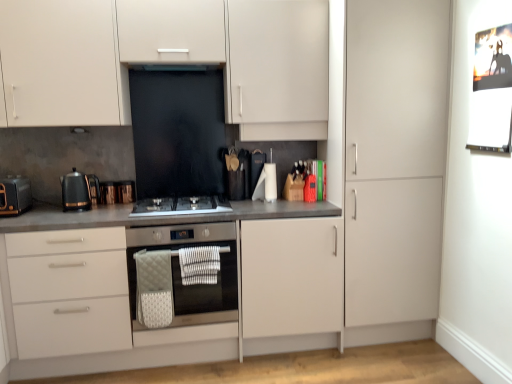
Question: Is copper metallic toaster at left, the 1th appliance viewed from the left, positioned with its back to matte gray countertop at center?

Choices:
 (A) yes
 (B) no

Answer: (B)

Question: Is copper metallic toaster at left, the 2th appliance viewed from the right, closer to the viewer compared to matte gray countertop at center?

Choices:
 (A) yes
 (B) no

Answer: (B)

Question: Is copper metallic toaster at left, the 1th appliance viewed from the left, smaller than matte gray countertop at center?

Choices:
 (A) yes
 (B) no

Answer: (A)

Question: From a real-world perspective, is copper metallic toaster at left, the 1th appliance viewed from the left, on top of matte gray countertop at center?

Choices:
 (A) yes
 (B) no

Answer: (A)

Question: Are copper metallic toaster at left, the 2th appliance viewed from the right, and matte gray countertop at center making contact?

Choices:
 (A) no
 (B) yes

Answer: (A)

Question: Does copper metallic toaster at left, the 1th appliance viewed from the left, have a lesser height compared to matte gray countertop at center?

Choices:
 (A) yes
 (B) no

Answer: (A)

Question: Can you confirm if matte white cabinets at upper center is smaller than metallic silver bulletin board at upper right?

Choices:
 (A) no
 (B) yes

Answer: (A)

Question: Does matte white cabinets at upper center have a greater width compared to metallic silver bulletin board at upper right?

Choices:
 (A) yes
 (B) no

Answer: (A)

Question: Is matte white cabinets at upper center shorter than metallic silver bulletin board at upper right?

Choices:
 (A) no
 (B) yes

Answer: (A)

Question: Does matte white cabinets at upper center lie behind metallic silver bulletin board at upper right?

Choices:
 (A) yes
 (B) no

Answer: (A)

Question: Is matte white cabinets at upper center bigger than metallic silver bulletin board at upper right?

Choices:
 (A) no
 (B) yes

Answer: (B)

Question: Can you confirm if matte white cabinets at upper center is thinner than metallic silver bulletin board at upper right?

Choices:
 (A) yes
 (B) no

Answer: (B)

Question: Is black glass exhaust hood at upper center positioned with its back to matte gray countertop at center?

Choices:
 (A) yes
 (B) no

Answer: (B)